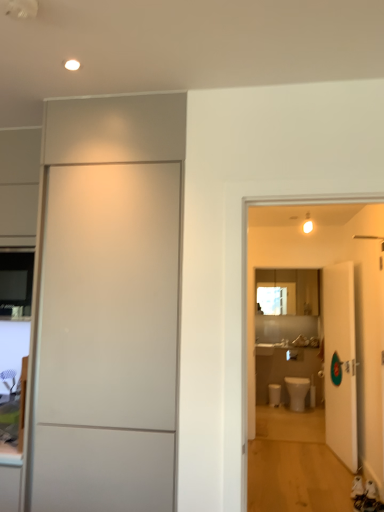
Question: From a real-world perspective, is white matte door at left, which is the 2th door from back to front, on top of white glossy toilet bowl at lower center?

Choices:
 (A) no
 (B) yes

Answer: (B)

Question: Considering the relative sizes of white matte door at left, arranged as the 2th door when viewed from the right, and white glossy toilet bowl at lower center in the image provided, is white matte door at left, arranged as the 2th door when viewed from the right, bigger than white glossy toilet bowl at lower center?

Choices:
 (A) yes
 (B) no

Answer: (A)

Question: Is white matte door at left, arranged as the 2th door when viewed from the right, directly adjacent to white glossy toilet bowl at lower center?

Choices:
 (A) yes
 (B) no

Answer: (B)

Question: From the image's perspective, is white matte door at left, which is the 2th door from back to front, located above white glossy toilet bowl at lower center?

Choices:
 (A) yes
 (B) no

Answer: (A)

Question: Is white matte door at left, which is the 2th door from back to front, oriented towards white glossy toilet bowl at lower center?

Choices:
 (A) no
 (B) yes

Answer: (A)

Question: Is white matte door at left, which is the 2th door from back to front, looking in the opposite direction of white glossy toilet bowl at lower center?

Choices:
 (A) no
 (B) yes

Answer: (B)

Question: Does white glossy toilet bowl at lower center have a lesser width compared to white glossy toilet at center?

Choices:
 (A) yes
 (B) no

Answer: (A)

Question: Considering the relative positions of white glossy toilet bowl at lower center and white glossy toilet at center in the image provided, is white glossy toilet bowl at lower center in front of white glossy toilet at center?

Choices:
 (A) no
 (B) yes

Answer: (A)

Question: Is white glossy toilet bowl at lower center to the left of white glossy toilet at center from the viewer's perspective?

Choices:
 (A) yes
 (B) no

Answer: (A)

Question: From the image's perspective, is white glossy toilet bowl at lower center over white glossy toilet at center?

Choices:
 (A) yes
 (B) no

Answer: (B)

Question: Is white glossy toilet bowl at lower center not within white glossy toilet at center?

Choices:
 (A) no
 (B) yes

Answer: (B)

Question: Can you confirm if white glossy toilet bowl at lower center is taller than white glossy toilet at center?

Choices:
 (A) no
 (B) yes

Answer: (A)

Question: Is white glossy toilet at center outside of white matte door at left, which is counted as the 1th door, starting from the left?

Choices:
 (A) yes
 (B) no

Answer: (A)